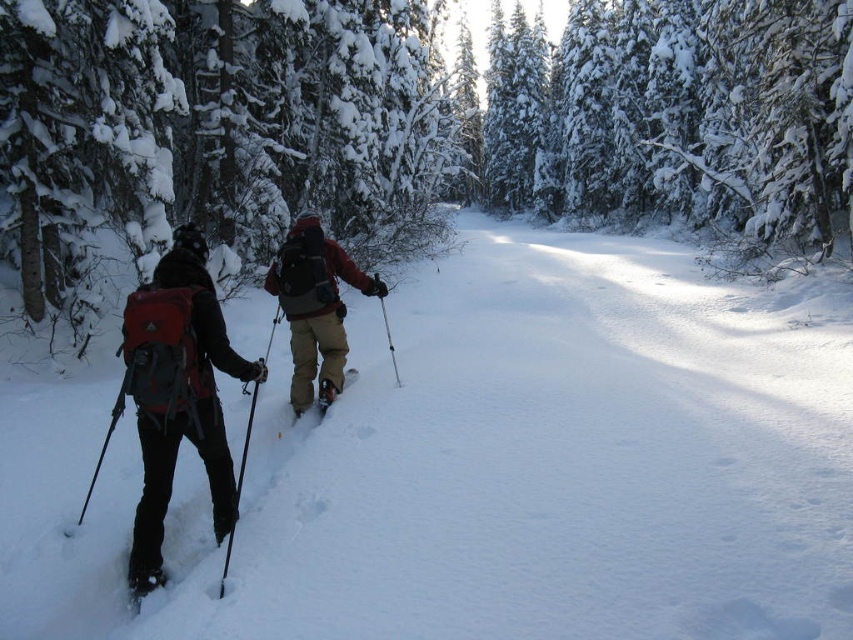
Which of these two, snowy evergreen trees at center or metallic silver ski pole at center, stands taller?

snowy evergreen trees at center

Can you confirm if snowy evergreen trees at center is positioned to the right of metallic silver ski pole at center?

Indeed, snowy evergreen trees at center is positioned on the right side of metallic silver ski pole at center.

Describe the element at coordinates (404, 131) in the screenshot. I see `snowy evergreen trees at center` at that location.

This screenshot has height=640, width=853. Find the location of `snowy evergreen trees at center`. snowy evergreen trees at center is located at coordinates (404, 131).

Which is more to the right, black plastic ski pole at left or metallic silver ski pole at center?

From the viewer's perspective, metallic silver ski pole at center appears more on the right side.

Can you confirm if black plastic ski pole at left is smaller than metallic silver ski pole at center?

Incorrect, black plastic ski pole at left is not smaller in size than metallic silver ski pole at center.

Locate an element on the screen. This screenshot has width=853, height=640. black plastic ski pole at left is located at coordinates (103, 444).

Looking at this image, is matte red backpack at left bigger than metallic silver ski pole at center?

Yes.

How distant is matte red backpack at left from metallic silver ski pole at center?

7.29 meters

What do you see at coordinates (178, 387) in the screenshot?
I see `matte red backpack at left` at bounding box center [178, 387].

I want to click on matte red backpack at left, so (178, 387).